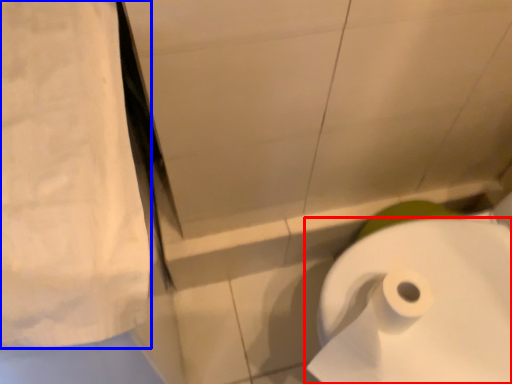
Question: Which object is further to the camera taking this photo, toilet paper (highlighted by a red box) or linen (highlighted by a blue box)?

Choices:
 (A) toilet paper
 (B) linen

Answer: (A)